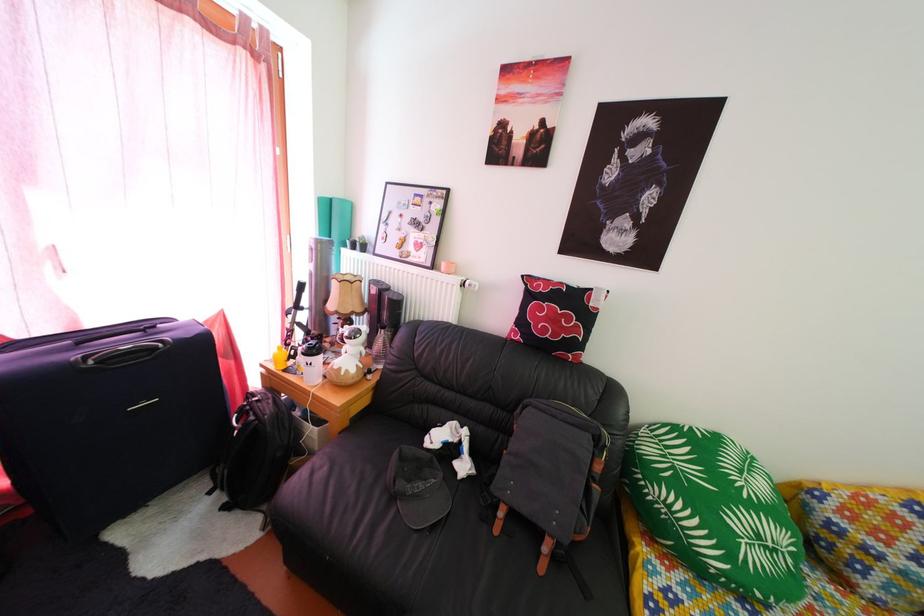
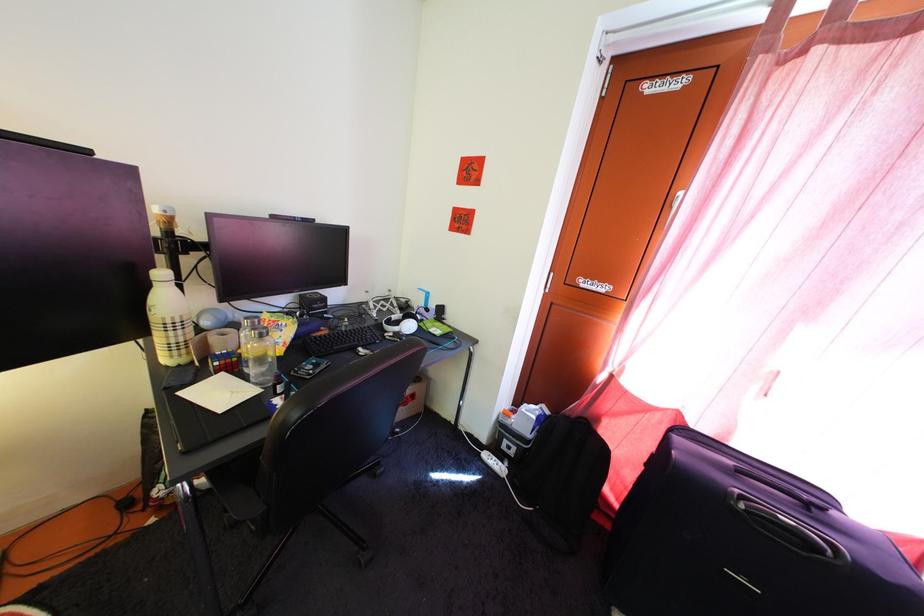
Question: The first image is from the beginning of the video and the second image is from the end. How did the camera likely rotate when shooting the video?

Choices:
 (A) Left
 (B) Right
 (C) Up
 (D) Down

Answer: (A)